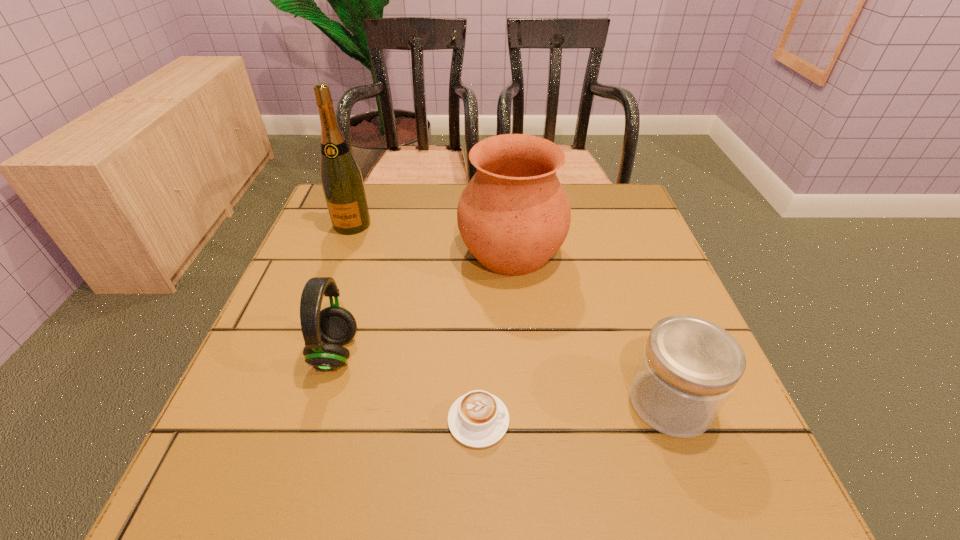
Locate an element on the screen. free point between the cappuccino and the rightmost object is located at coordinates (574, 411).

Locate an element on the screen. The image size is (960, 540). free spot between the headset and the shortest object is located at coordinates (407, 387).

Where is `free spot between the tallest object and the cappuccino`? The height and width of the screenshot is (540, 960). free spot between the tallest object and the cappuccino is located at coordinates (416, 322).

The width and height of the screenshot is (960, 540). I want to click on object that is the third nearest to the headset, so click(341, 178).

The height and width of the screenshot is (540, 960). I want to click on object that is the fourth closest one to the cappuccino, so click(x=341, y=178).

This screenshot has width=960, height=540. I want to click on vacant space that satisfies the following two spatial constraints: 1. on the front-facing side of the pottery; 2. on the right side of the wine bottle, so click(342, 253).

Identify the location of free space that satisfies the following two spatial constraints: 1. on the front-facing side of the second shortest object; 2. on the right side of the tallest object. (286, 402).

The image size is (960, 540). I want to click on vacant space that satisfies the following two spatial constraints: 1. on the front side of the fourth shortest object; 2. on the left side of the rightmost object, so click(524, 402).

Where is `free space that satisfies the following two spatial constraints: 1. on the front-facing side of the pottery; 2. on the right side of the tallest object`? The width and height of the screenshot is (960, 540). free space that satisfies the following two spatial constraints: 1. on the front-facing side of the pottery; 2. on the right side of the tallest object is located at coordinates (342, 253).

At what (x,y) coordinates should I click in order to perform the action: click on free space in the image that satisfies the following two spatial constraints: 1. on the front side of the fourth shortest object; 2. with the handle on the right side of the cappuccino. Please return your answer as a coordinate pair (x, y). Looking at the image, I should click on (525, 420).